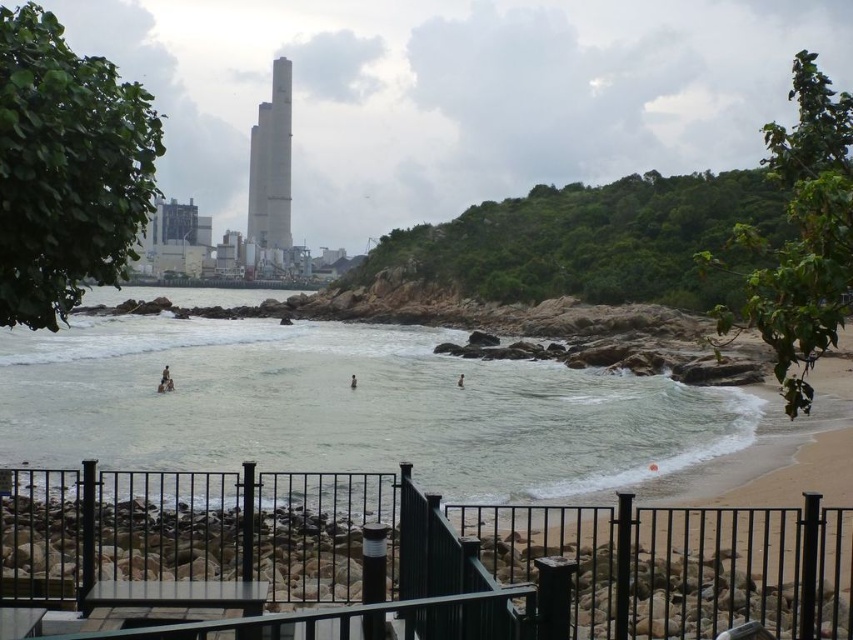
Question: Which point is closer to the camera taking this photo?

Choices:
 (A) (265, 120)
 (B) (163, 380)
 (C) (161, 417)
 (D) (352, 387)

Answer: (C)

Question: Is brown skin at center smaller than brown skin at water center?

Choices:
 (A) no
 (B) yes

Answer: (B)

Question: Does skinny person at center come behind brown skin at water center?

Choices:
 (A) no
 (B) yes

Answer: (A)

Question: Is gray concrete tower at center to the right of brown skin at center from the viewer's perspective?

Choices:
 (A) no
 (B) yes

Answer: (A)

Question: Which point is closer to the camera taking this photo?

Choices:
 (A) (263, 224)
 (B) (206, 410)
 (C) (169, 380)
 (D) (352, 384)

Answer: (B)

Question: Which point is closer to the camera?

Choices:
 (A) clear water at beach right
 (B) brown skin at water center
 (C) gray concrete tower at center
 (D) brown skin at center

Answer: (A)